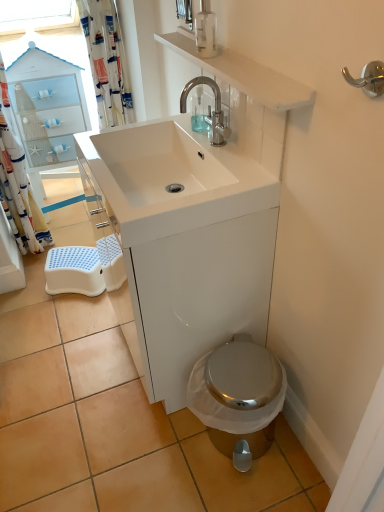
Question: From a real-world perspective, is white glossy sink at upper center above or below clear glass soap dispenser at upper center, the first soap dispenser from the front?

Choices:
 (A) above
 (B) below

Answer: (B)

Question: In terms of size, does white glossy sink at upper center appear bigger or smaller than clear glass soap dispenser at upper center, positioned as the 2th soap dispenser in back-to-front order?

Choices:
 (A) big
 (B) small

Answer: (A)

Question: Based on their relative distances, which object is farther from the white fabric shower curtain at left, the 2th shower curtain viewed from the right?

Choices:
 (A) white glossy sink at upper center
 (B) transparent plastic soap dispenser at center, the first soap dispenser when ordered from back to front
 (C) clear glass soap dispenser at upper center, the 1th soap dispenser in the top-to-bottom sequence
 (D) white plastic step stool at lower left
 (E) polished chrome faucet at upper center

Answer: (C)

Question: Estimate the real-world distances between objects in this image. Which object is farther from the white glossy sink at upper center?

Choices:
 (A) white fabric shower curtain at upper left, arranged as the 2th shower curtain when viewed from the left
 (B) transparent plastic soap dispenser at center, the first soap dispenser when ordered from back to front
 (C) polished chrome hook at upper right
 (D) white fabric shower curtain at left, the 2th shower curtain viewed from the right
 (E) clear glass soap dispenser at upper center, the 1th soap dispenser in the top-to-bottom sequence

Answer: (D)